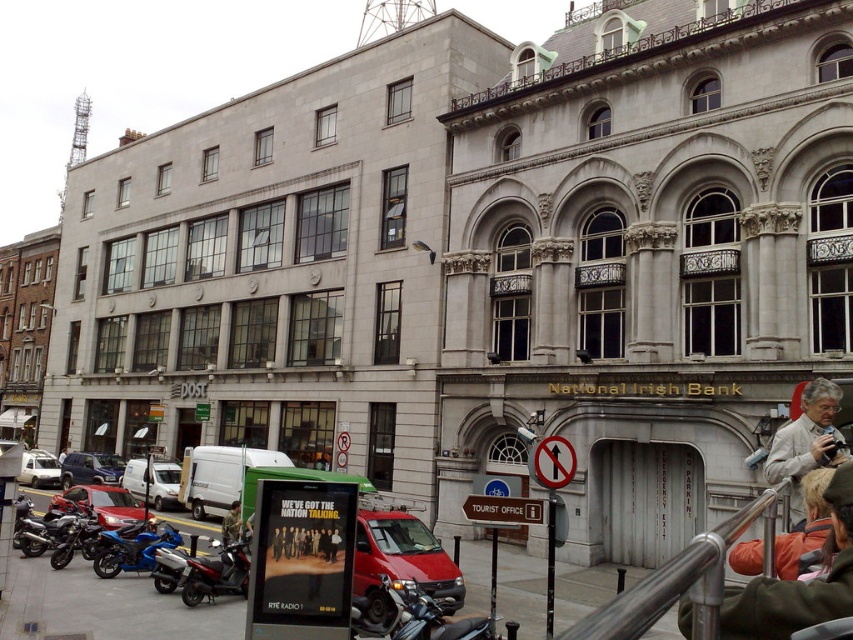
You are standing on the street looking at the building. There are two points marked on the building facade. The first point is at coordinates point (222, 588) and the second is at point (36, 545). From your perspective, which point appears closer to you?

Point (222, 588) is in front of point (36, 545), so it appears closer to you.

You are a delivery person who needs to park your metallic silver scooter at center and your brushed metal motorcycle at lower left in this urban area. Based on the scene, where should each vehicle be placed to ensure they are visible from the street?

The metallic silver scooter at center should be placed above the brushed metal motorcycle at lower left to ensure both are visible from the street, as the scooter is positioned higher up and the motorcycle is lower down.